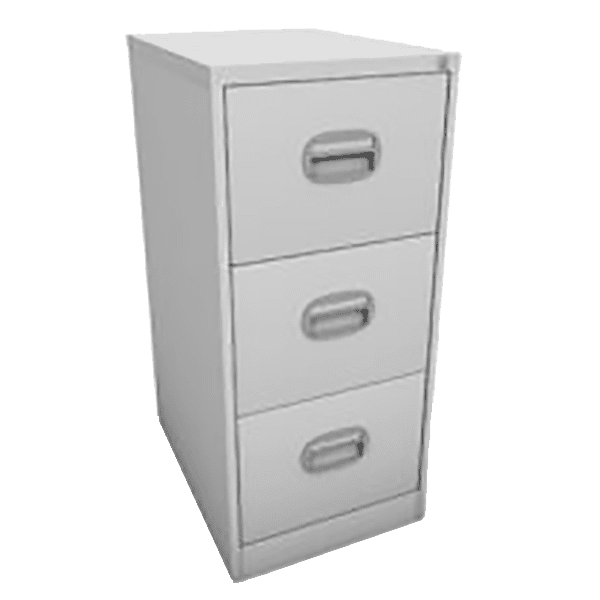
Where is `grey cabinet`? This screenshot has height=600, width=600. grey cabinet is located at coordinates pos(200,406).